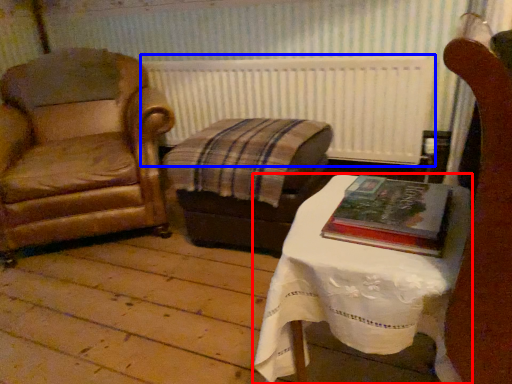
Question: Which point is closer to the camera, table (highlighted by a red box) or radiator (highlighted by a blue box)?

Choices:
 (A) table
 (B) radiator

Answer: (A)